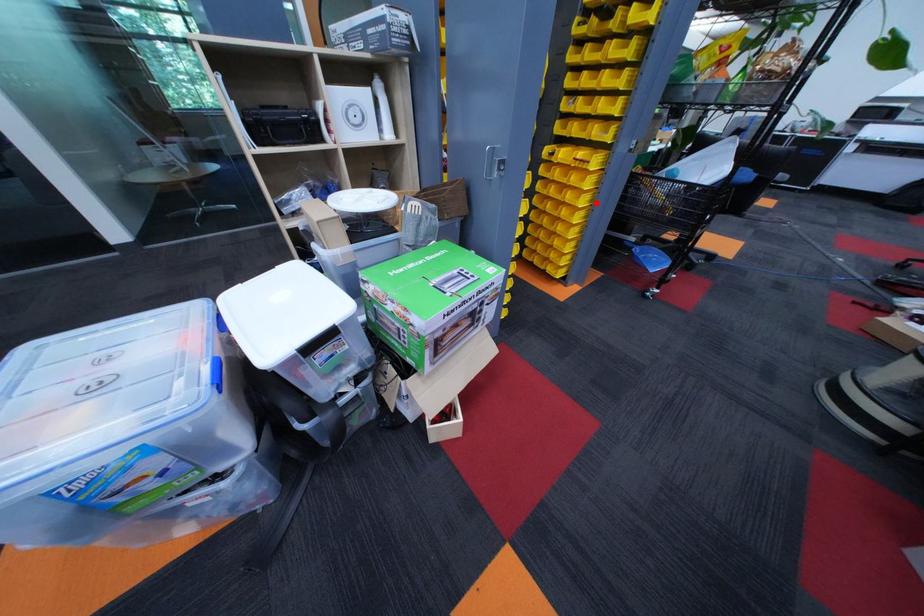
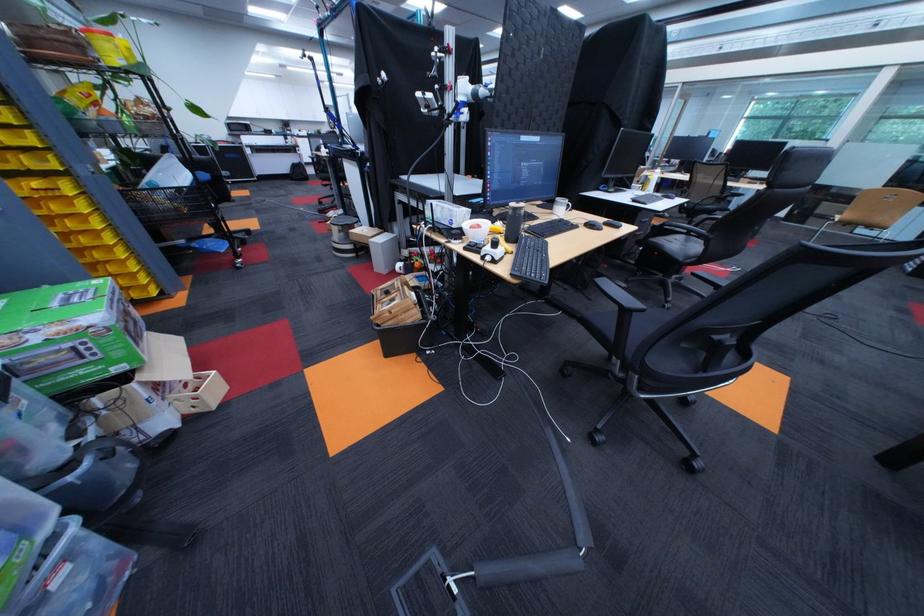
Question: I am providing you with two images of the same scene from different viewpoints. Image1 has a red point marked. In image2, the corresponding 3D location appears at what relative position? Reply with the corresponding letter.

Choices:
 (A) Closer
 (B) Farther

Answer: (B)